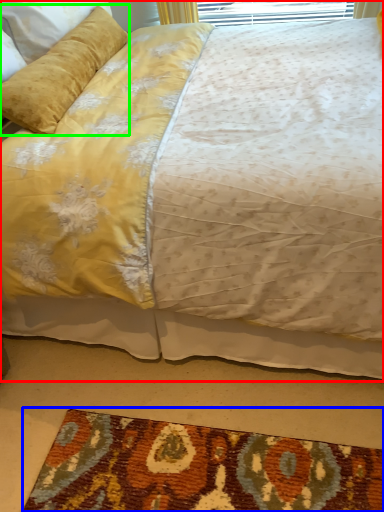
Question: Estimate the real-world distances between objects in this image. Which object is closer to bed (highlighted by a red box), mat (highlighted by a blue box) or pillow (highlighted by a green box)?

Choices:
 (A) mat
 (B) pillow

Answer: (B)